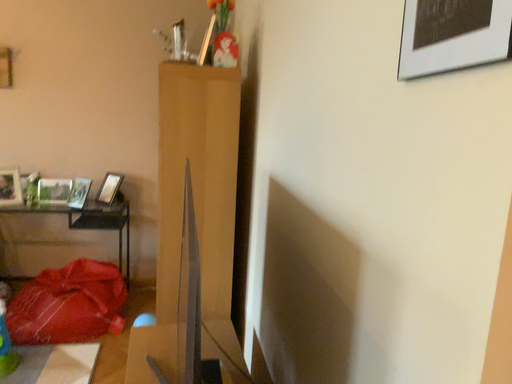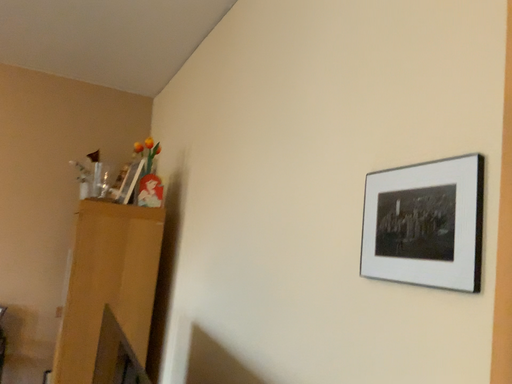
Question: How did the camera likely rotate when shooting the video?

Choices:
 (A) rotated right
 (B) rotated left

Answer: (A)